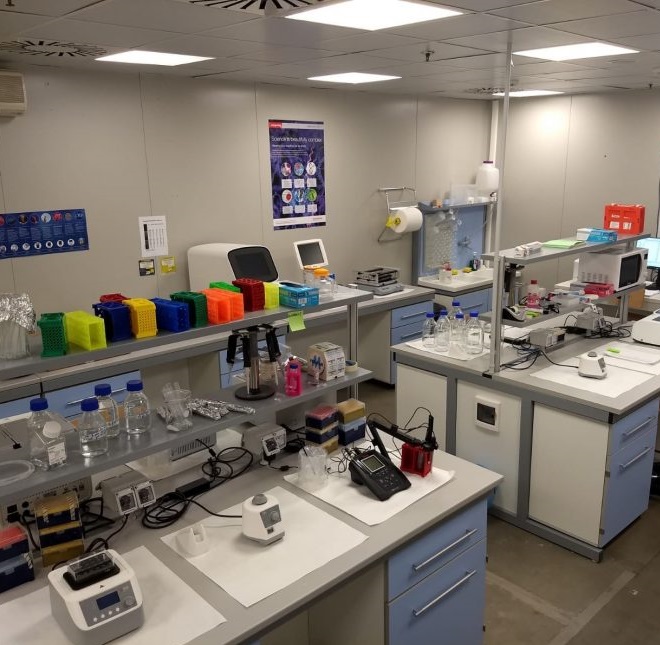
Find the location of a particular element. The height and width of the screenshot is (645, 660). paper towel roll is located at coordinates (400, 221).